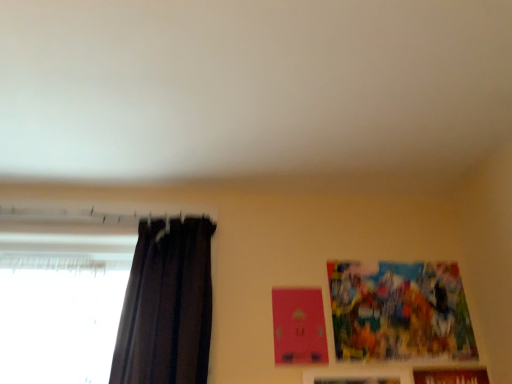
Question: Is brown wooden picture frame at lower right, which is the third picture frame in top-to-bottom order, smaller than colorful paper picture frame at upper right, the 3th picture frame ordered from the bottom?

Choices:
 (A) no
 (B) yes

Answer: (B)

Question: Is brown wooden picture frame at lower right, which is the third picture frame in top-to-bottom order, shorter than colorful paper picture frame at upper right, the 3th picture frame ordered from the bottom?

Choices:
 (A) no
 (B) yes

Answer: (A)

Question: Does brown wooden picture frame at lower right, the 1th picture frame ordered from the bottom, have a larger size compared to colorful paper picture frame at upper right, which is the 1th picture frame from top to bottom?

Choices:
 (A) no
 (B) yes

Answer: (A)

Question: Can we say brown wooden picture frame at lower right, the 1th picture frame ordered from the bottom, lies outside colorful paper picture frame at upper right, which is the 1th picture frame from top to bottom?

Choices:
 (A) yes
 (B) no

Answer: (A)

Question: Is brown wooden picture frame at lower right, which is the third picture frame in top-to-bottom order, behind colorful paper picture frame at upper right, which is the 1th picture frame from top to bottom?

Choices:
 (A) no
 (B) yes

Answer: (A)

Question: Can you confirm if brown wooden picture frame at lower right, which is the third picture frame in top-to-bottom order, is thinner than colorful paper picture frame at upper right, which is the 1th picture frame from top to bottom?

Choices:
 (A) no
 (B) yes

Answer: (A)

Question: Is dark matte curtain at left far away from colorful paper picture frame at upper right, the 3th picture frame ordered from the bottom?

Choices:
 (A) yes
 (B) no

Answer: (B)

Question: Is colorful paper picture frame at upper right, the 3th picture frame ordered from the bottom, a part of dark matte curtain at left?

Choices:
 (A) yes
 (B) no

Answer: (B)

Question: From a real-world perspective, does dark matte curtain at left sit lower than colorful paper picture frame at upper right, the 3th picture frame ordered from the bottom?

Choices:
 (A) no
 (B) yes

Answer: (A)

Question: Are dark matte curtain at left and colorful paper picture frame at upper right, which is the 1th picture frame from top to bottom, beside each other?

Choices:
 (A) yes
 (B) no

Answer: (B)

Question: From the image's perspective, is dark matte curtain at left located beneath colorful paper picture frame at upper right, which is the 1th picture frame from top to bottom?

Choices:
 (A) yes
 (B) no

Answer: (B)

Question: Is dark matte curtain at left located outside colorful paper picture frame at upper right, the 3th picture frame ordered from the bottom?

Choices:
 (A) no
 (B) yes

Answer: (B)

Question: Is dark matte curtain at left far from brown wooden picture frame at lower right, the 1th picture frame ordered from the bottom?

Choices:
 (A) no
 (B) yes

Answer: (B)